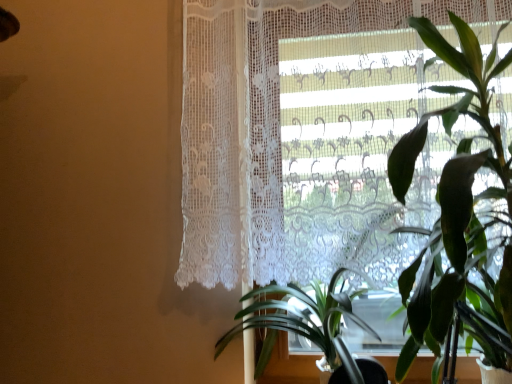
Identify the location of green leafy plant at right, the second houseplant positioned from the left. (458, 215).

Describe the element at coordinates (311, 133) in the screenshot. I see `white lace curtain at upper right` at that location.

Locate an element on the screen. This screenshot has height=384, width=512. green leafy plant at right, the second houseplant positioned from the left is located at coordinates (458, 215).

Is green leafy plant at right, the second houseplant positioned from the left, directly adjacent to green leafy plant at center, the first houseplant positioned from the left?

green leafy plant at right, the second houseplant positioned from the left, and green leafy plant at center, the first houseplant positioned from the left, are clearly separated.

Which is closer to the camera, [494,286] or [351,310]?

Point [494,286] is positioned closer to the camera compared to point [351,310].

From the image's perspective, which one is positioned lower, green leafy plant at right, the second houseplant positioned from the left, or green leafy plant at center, the first houseplant positioned from the left?

From the image's view, green leafy plant at center, the first houseplant positioned from the left, is below.

Based on the photo, considering the sizes of green leafy plant at right, the first houseplant in the right-to-left sequence, and green leafy plant at center, the first houseplant positioned from the left, in the image, is green leafy plant at right, the first houseplant in the right-to-left sequence, taller or shorter than green leafy plant at center, the first houseplant positioned from the left,?

Clearly, green leafy plant at right, the first houseplant in the right-to-left sequence, is taller compared to green leafy plant at center, the first houseplant positioned from the left.

Would you say green leafy plant at center, the second houseplant positioned from the right, is inside or outside white lace curtain at upper right?

green leafy plant at center, the second houseplant positioned from the right, lies outside white lace curtain at upper right.

Is green leafy plant at center, the second houseplant positioned from the right, looking in the opposite direction of white lace curtain at upper right?

That's not correct — green leafy plant at center, the second houseplant positioned from the right, is not looking away from white lace curtain at upper right.

Between green leafy plant at center, the second houseplant positioned from the right, and white lace curtain at upper right, which one has larger width?

Wider between the two is green leafy plant at center, the second houseplant positioned from the right.

Can you tell me how much green leafy plant at center, the first houseplant positioned from the left, and white lace curtain at upper right differ in facing direction?

1.52 degrees.

Is green leafy plant at center, the first houseplant positioned from the left, aimed at green leafy plant at right, the second houseplant positioned from the left?

No, green leafy plant at center, the first houseplant positioned from the left, is not turned towards green leafy plant at right, the second houseplant positioned from the left.

Would you consider green leafy plant at center, the first houseplant positioned from the left, to be distant from green leafy plant at right, the first houseplant in the right-to-left sequence?

That's not correct — green leafy plant at center, the first houseplant positioned from the left, is a little close to green leafy plant at right, the first houseplant in the right-to-left sequence.

Does green leafy plant at center, the first houseplant positioned from the left, have a lesser height compared to green leafy plant at right, the first houseplant in the right-to-left sequence?

Indeed, green leafy plant at center, the first houseplant positioned from the left, has a lesser height compared to green leafy plant at right, the first houseplant in the right-to-left sequence.

Looking at their sizes, would you say green leafy plant at center, the first houseplant positioned from the left, is wider or thinner than green leafy plant at right, the first houseplant in the right-to-left sequence?

In the image, green leafy plant at center, the first houseplant positioned from the left, appears to be wider than green leafy plant at right, the first houseplant in the right-to-left sequence.

Is white lace curtain at upper right not near green leafy plant at center, the first houseplant positioned from the left?

Actually, white lace curtain at upper right and green leafy plant at center, the first houseplant positioned from the left, are a little close together.

Is white lace curtain at upper right thinner than green leafy plant at center, the second houseplant positioned from the right?

Indeed, white lace curtain at upper right has a lesser width compared to green leafy plant at center, the second houseplant positioned from the right.

Considering the relative sizes of white lace curtain at upper right and green leafy plant at center, the first houseplant positioned from the left, in the image provided, is white lace curtain at upper right bigger than green leafy plant at center, the first houseplant positioned from the left,?

Indeed, white lace curtain at upper right has a larger size compared to green leafy plant at center, the first houseplant positioned from the left.

From a real-world perspective, is white lace curtain at upper right located higher than green leafy plant at center, the first houseplant positioned from the left?

Yes.

Is white lace curtain at upper right taller or shorter than green leafy plant at right, the first houseplant in the right-to-left sequence?

In the image, white lace curtain at upper right appears to be taller than green leafy plant at right, the first houseplant in the right-to-left sequence.

Which is in front, white lace curtain at upper right or green leafy plant at right, the first houseplant in the right-to-left sequence?

green leafy plant at right, the first houseplant in the right-to-left sequence.

Considering the sizes of objects white lace curtain at upper right and green leafy plant at right, the first houseplant in the right-to-left sequence, in the image provided, who is smaller, white lace curtain at upper right or green leafy plant at right, the first houseplant in the right-to-left sequence,?

Smaller between the two is white lace curtain at upper right.

Visually, is white lace curtain at upper right positioned to the left or to the right of green leafy plant at right, the second houseplant positioned from the left?

white lace curtain at upper right is positioned on green leafy plant at right, the second houseplant positioned from the left,'s left side.

Which of these two, green leafy plant at right, the second houseplant positioned from the left, or white lace curtain at upper right, stands shorter?

Standing shorter between the two is green leafy plant at right, the second houseplant positioned from the left.

Is green leafy plant at right, the second houseplant positioned from the left, facing towards white lace curtain at upper right?

No, green leafy plant at right, the second houseplant positioned from the left, does not turn towards white lace curtain at upper right.

Which object is wider, green leafy plant at right, the first houseplant in the right-to-left sequence, or white lace curtain at upper right?

green leafy plant at right, the first houseplant in the right-to-left sequence.

Considering their positions, is green leafy plant at right, the first houseplant in the right-to-left sequence, located in front of or behind white lace curtain at upper right?

green leafy plant at right, the first houseplant in the right-to-left sequence, is in front of white lace curtain at upper right.

In order to click on houseplant that is on the left side of green leafy plant at right, the first houseplant in the right-to-left sequence in this screenshot , I will do `click(306, 324)`.

This screenshot has width=512, height=384. I want to click on curtain on the right side of green leafy plant at center, the first houseplant positioned from the left, so click(311, 133).

Looking at the image, which one is located further to green leafy plant at right, the first houseplant in the right-to-left sequence, green leafy plant at center, the second houseplant positioned from the right, or white lace curtain at upper right?

The object further to green leafy plant at right, the first houseplant in the right-to-left sequence, is green leafy plant at center, the second houseplant positioned from the right.

Looking at the image, which one is located closer to white lace curtain at upper right, green leafy plant at center, the first houseplant positioned from the left, or green leafy plant at right, the first houseplant in the right-to-left sequence?

Based on the image, green leafy plant at right, the first houseplant in the right-to-left sequence, appears to be nearer to white lace curtain at upper right.

From the image, which object appears to be nearer to green leafy plant at center, the first houseplant positioned from the left, green leafy plant at right, the first houseplant in the right-to-left sequence, or white lace curtain at upper right?

green leafy plant at right, the first houseplant in the right-to-left sequence, lies closer to green leafy plant at center, the first houseplant positioned from the left, than the other object.

Based on their spatial positions, is white lace curtain at upper right or green leafy plant at right, the second houseplant positioned from the left, closer to green leafy plant at center, the second houseplant positioned from the right?

green leafy plant at right, the second houseplant positioned from the left.

From the image, which object appears to be nearer to green leafy plant at right, the second houseplant positioned from the left, white lace curtain at upper right or green leafy plant at center, the second houseplant positioned from the right?

white lace curtain at upper right is positioned closer to the anchor green leafy plant at right, the second houseplant positioned from the left.

In the scene shown: From the image, which object appears to be farther from white lace curtain at upper right, green leafy plant at right, the second houseplant positioned from the left, or green leafy plant at center, the first houseplant positioned from the left?

The object further to white lace curtain at upper right is green leafy plant at center, the first houseplant positioned from the left.

The height and width of the screenshot is (384, 512). I want to click on houseplant between white lace curtain at upper right and green leafy plant at center, the second houseplant positioned from the right, vertically, so click(458, 215).